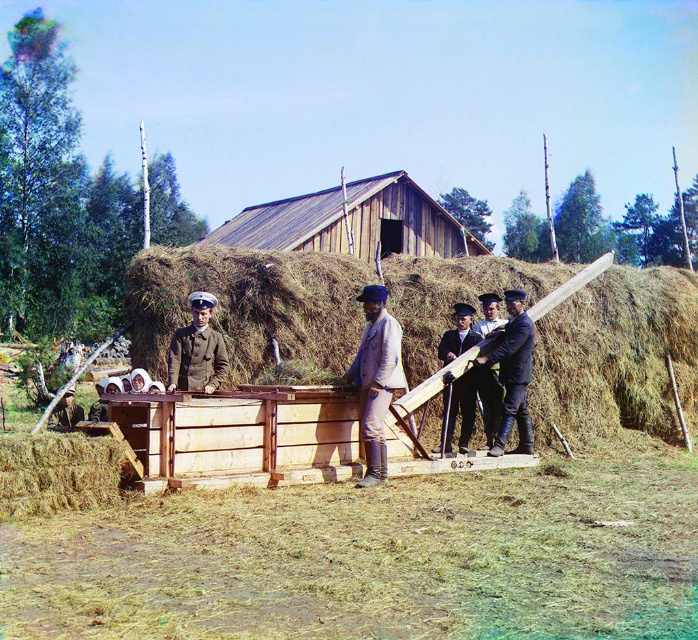
Can you confirm if brown uniform at center is positioned above dark brown uniform at center?

Indeed, brown uniform at center is positioned over dark brown uniform at center.

Between point (215, 349) and point (452, 438), which one is positioned behind?

The point (452, 438) is more distant.

Locate an element on the screen. The height and width of the screenshot is (640, 698). brown uniform at center is located at coordinates (195, 349).

Who is positioned more to the left, light brown leather jacket at center or brown uniform at center?

Positioned to the left is brown uniform at center.

Who is taller, light brown leather jacket at center or brown uniform at center?

light brown leather jacket at center is taller.

Consider the image. Measure the distance between point (x=364, y=477) and camera.

Point (x=364, y=477) is 9.43 meters from camera.

Find the location of a particular element. Image resolution: width=698 pixels, height=640 pixels. light brown leather jacket at center is located at coordinates (376, 378).

What do you see at coordinates (616, 355) in the screenshot?
I see `brown straw at center` at bounding box center [616, 355].

Does brown straw at center appear on the left side of light brown leather jacket at center?

Incorrect, brown straw at center is not on the left side of light brown leather jacket at center.

Locate an element on the screen. The height and width of the screenshot is (640, 698). brown straw at center is located at coordinates (616, 355).